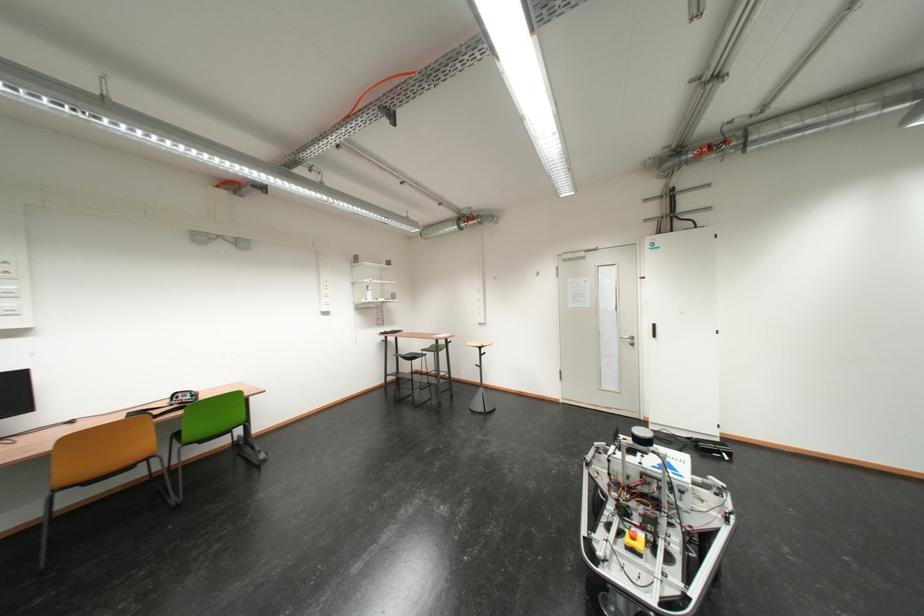
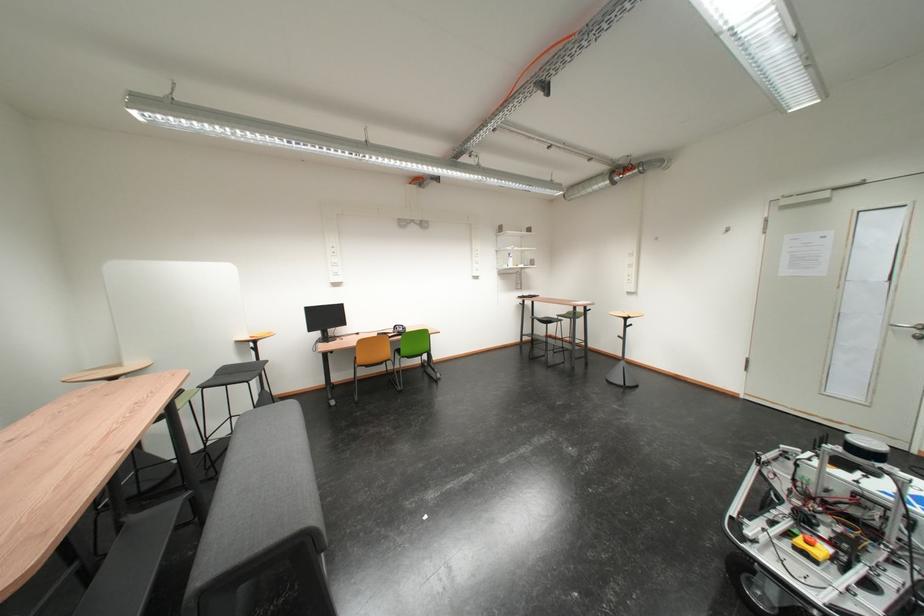
The point at (410, 360) is marked in the first image. Where is the corresponding point in the second image?

(546, 323)